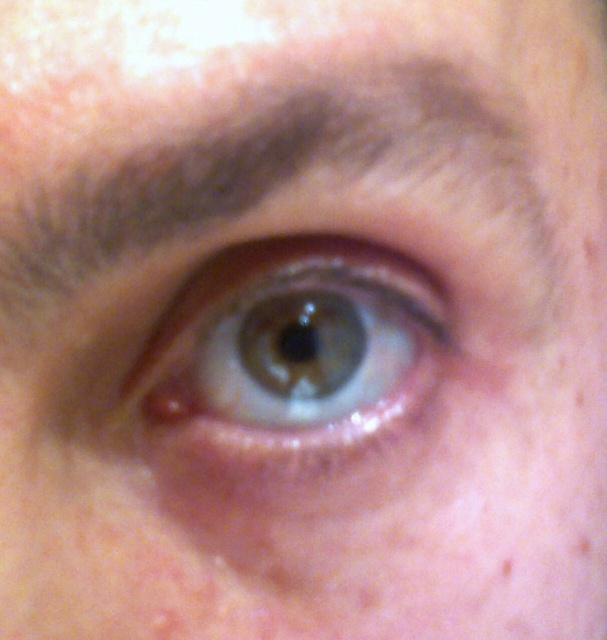
Question: Which point is farther to the camera?

Choices:
 (A) (314, 129)
 (B) (345, 433)

Answer: (B)

Question: Can you confirm if brown fuzzy eyebrow at upper center is positioned to the right of green matte eye at center?

Choices:
 (A) yes
 (B) no

Answer: (A)

Question: Can you confirm if brown fuzzy eyebrow at upper center is thinner than green matte eye at center?

Choices:
 (A) yes
 (B) no

Answer: (B)

Question: Which of the following is the closest to the observer?

Choices:
 (A) (438, 284)
 (B) (455, 176)

Answer: (B)

Question: Can you confirm if brown fuzzy eyebrow at upper center is positioned below green matte eye at center?

Choices:
 (A) no
 (B) yes

Answer: (A)

Question: Which of the following is the closest to the observer?

Choices:
 (A) (198, 179)
 (B) (148, 353)

Answer: (A)